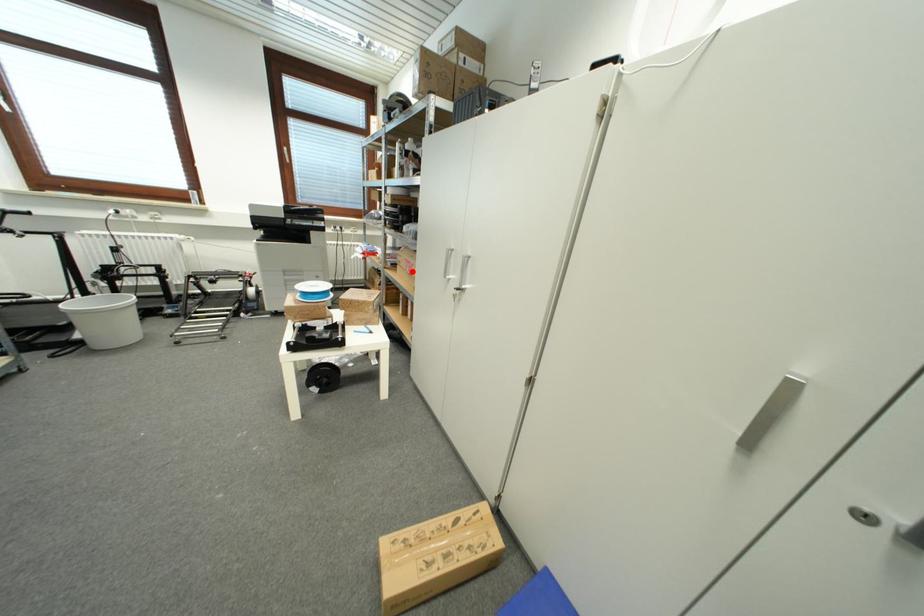
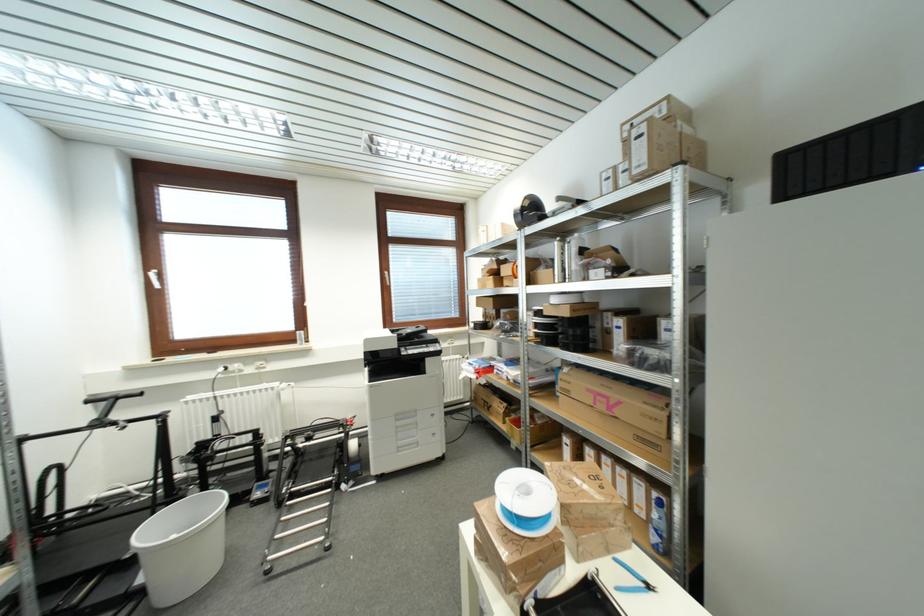
The point at the highlighted location is marked in the first image. Where is the corresponding point in the second image?

(605, 408)